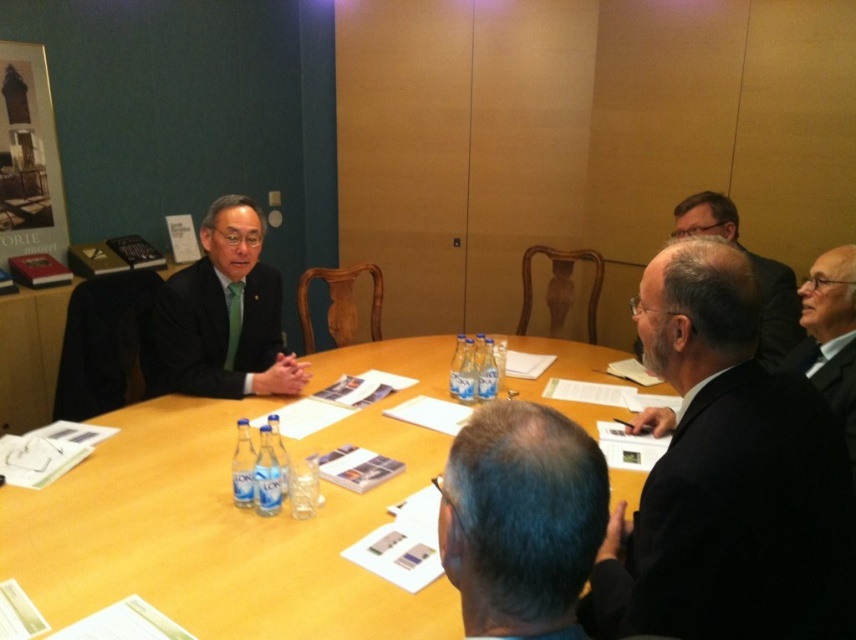
Which is above, black suit at center or gray hair at center?

gray hair at center is higher up.

Image resolution: width=856 pixels, height=640 pixels. Describe the element at coordinates (726, 477) in the screenshot. I see `black suit at center` at that location.

In order to click on black suit at center in this screenshot , I will do `click(726, 477)`.

The width and height of the screenshot is (856, 640). What are the coordinates of `black suit at center` in the screenshot? It's located at (726, 477).

Does wooden at center appear under matte black suit at center?

Correct, wooden at center is located below matte black suit at center.

Between wooden at center and matte black suit at center, which one appears on the right side from the viewer's perspective?

Positioned to the right is wooden at center.

Is point (334, 580) positioned before point (269, 352)?

Yes.

This screenshot has height=640, width=856. Identify the location of wooden at center. (230, 518).

Is matte black suit at upper right to the left of black matte suit at lower right from the viewer's perspective?

Correct, you'll find matte black suit at upper right to the left of black matte suit at lower right.

Does matte black suit at upper right appear over black matte suit at lower right?

Indeed, matte black suit at upper right is positioned over black matte suit at lower right.

Image resolution: width=856 pixels, height=640 pixels. I want to click on matte black suit at upper right, so point(753,269).

Where is `matte black suit at upper right`? matte black suit at upper right is located at coordinates (753, 269).